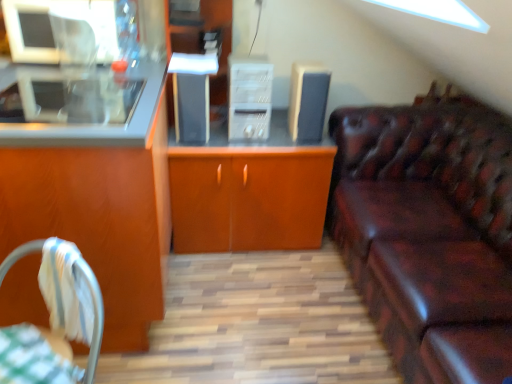
Question: Is wooden cabinet at center, the 2th cabinetry when ordered from left to right, to the right of green checkered tablecloth at lower left from the viewer's perspective?

Choices:
 (A) yes
 (B) no

Answer: (A)

Question: Is wooden cabinet at center, which is the 1th cabinetry in right-to-left order, in contact with green checkered tablecloth at lower left?

Choices:
 (A) no
 (B) yes

Answer: (A)

Question: Does wooden cabinet at center, the 2th cabinetry when ordered from left to right, have a larger size compared to green checkered tablecloth at lower left?

Choices:
 (A) yes
 (B) no

Answer: (A)

Question: Is wooden cabinet at center, the 2th cabinetry when ordered from left to right, in front of green checkered tablecloth at lower left?

Choices:
 (A) no
 (B) yes

Answer: (A)

Question: From a real-world perspective, is wooden cabinet at center, which is the 1th cabinetry in right-to-left order, beneath green checkered tablecloth at lower left?

Choices:
 (A) yes
 (B) no

Answer: (A)

Question: Choose the correct answer: Is wooden cabinet at center, which is the 1th cabinetry in right-to-left order, inside green checkered tablecloth at lower left or outside it?

Choices:
 (A) outside
 (B) inside

Answer: (A)

Question: In terms of width, does wooden cabinet at center, which is the 1th cabinetry in right-to-left order, look wider or thinner when compared to green checkered tablecloth at lower left?

Choices:
 (A) wide
 (B) thin

Answer: (A)

Question: Based on their positions, is wooden cabinet at center, the 2th cabinetry when ordered from left to right, located to the left or right of green checkered tablecloth at lower left?

Choices:
 (A) left
 (B) right

Answer: (B)

Question: In the image, is wooden cabinet at center, which is the 1th cabinetry in right-to-left order, positioned in front of or behind green checkered tablecloth at lower left?

Choices:
 (A) behind
 (B) front

Answer: (A)

Question: Considering the positions of point (200, 122) and point (55, 354), is point (200, 122) closer or farther from the camera than point (55, 354)?

Choices:
 (A) farther
 (B) closer

Answer: (A)

Question: In terms of width, does satin black speaker at center, which appears as the second appliance when viewed from the right, look wider or thinner when compared to green checkered tablecloth at lower left?

Choices:
 (A) wide
 (B) thin

Answer: (A)

Question: Is satin black speaker at center, which appears as the second appliance when viewed from the right, in front of or behind green checkered tablecloth at lower left in the image?

Choices:
 (A) behind
 (B) front

Answer: (A)

Question: From the image's perspective, is satin black speaker at center, which ranks as the first appliance in left-to-right order, located above or below green checkered tablecloth at lower left?

Choices:
 (A) above
 (B) below

Answer: (A)

Question: Considering the positions of green checkered tablecloth at lower left and matte wood cabinet at left, which is the first cabinetry in left-to-right order, in the image, is green checkered tablecloth at lower left wider or thinner than matte wood cabinet at left, which is the first cabinetry in left-to-right order,?

Choices:
 (A) wide
 (B) thin

Answer: (B)

Question: From a real-world perspective, is green checkered tablecloth at lower left positioned above or below matte wood cabinet at left, acting as the second cabinetry starting from the right?

Choices:
 (A) below
 (B) above

Answer: (A)